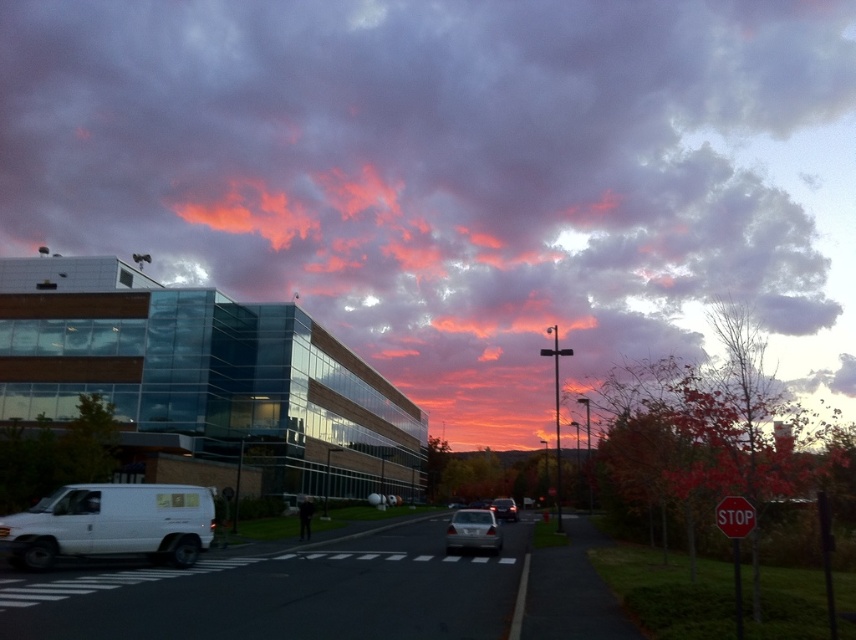
Does metallic silver sedan at center have a lesser width compared to red matte stop sign at center-right?

No.

Which is in front, point (476, 518) or point (752, 529)?

Point (752, 529) is more forward.

Locate an element on the screen. This screenshot has height=640, width=856. metallic silver sedan at center is located at coordinates (473, 531).

From the picture: Is metallic silver sedan at center to the right of shiny silver sedan at center from the viewer's perspective?

Incorrect, metallic silver sedan at center is not on the right side of shiny silver sedan at center.

Can you confirm if metallic silver sedan at center is taller than shiny silver sedan at center?

No.

Image resolution: width=856 pixels, height=640 pixels. I want to click on metallic silver sedan at center, so click(473, 531).

At what (x,y) coordinates should I click in order to perform the action: click on metallic silver sedan at center. Please return your answer as a coordinate pair (x, y). Looking at the image, I should click on (473, 531).

Is purple translucent clouds at upper center taller than shiny silver sedan at center?

Yes.

Between purple translucent clouds at upper center and shiny silver sedan at center, which one appears on the right side from the viewer's perspective?

shiny silver sedan at center is more to the right.

Is point (236, 250) closer to viewer compared to point (490, 502)?

No, (236, 250) is further to viewer.

Locate an element on the screen. Image resolution: width=856 pixels, height=640 pixels. purple translucent clouds at upper center is located at coordinates (456, 176).